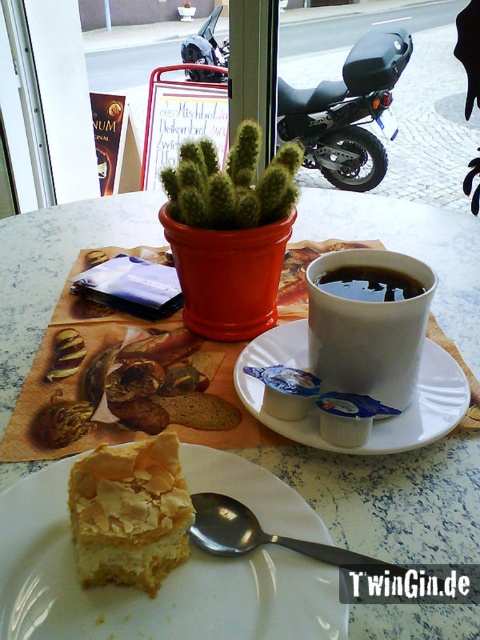
Question: Estimate the real-world distances between objects in this image. Which object is closer to the black matte cup at center?

Choices:
 (A) black matte motorcycle at upper center
 (B) golden flaky pastry at lower left

Answer: (B)

Question: Among these objects, which one is nearest to the camera?

Choices:
 (A) green fuzzy cactus at center
 (B) golden flaky pastry at lower left
 (C) black matte cup at upper center

Answer: (B)

Question: Based on their relative distances, which object is farther from the golden flaky pastry at lower left?

Choices:
 (A) black matte cup at center
 (B) white ceramic plate at center

Answer: (A)

Question: Is white marble table at center to the left of black matte motorcycle at upper center from the viewer's perspective?

Choices:
 (A) no
 (B) yes

Answer: (B)

Question: Does black matte cup at center appear on the right side of golden flaky pastry at lower left?

Choices:
 (A) no
 (B) yes

Answer: (B)

Question: Does white marble table at center have a larger size compared to white ceramic plate at center?

Choices:
 (A) no
 (B) yes

Answer: (B)